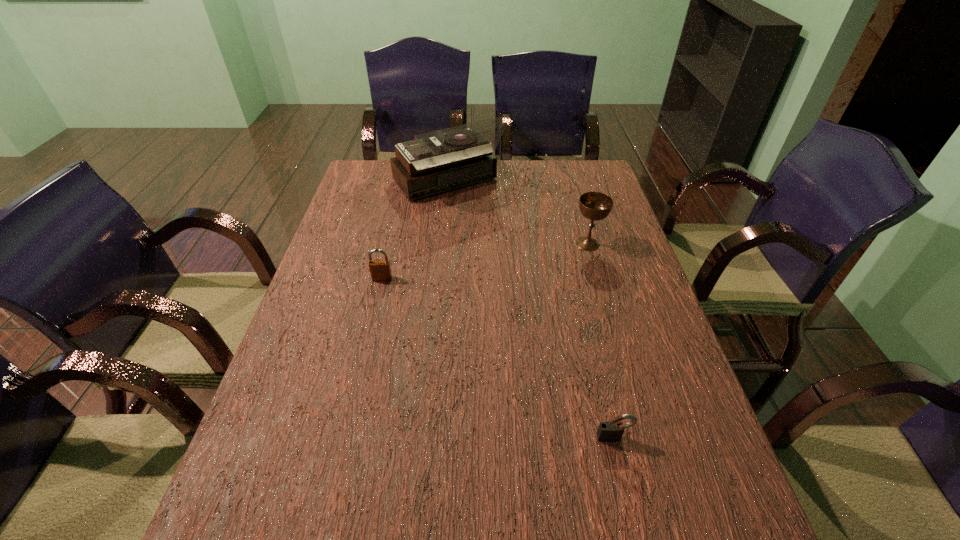
Find the location of a particular element. vacant space at the right edge of the desktop is located at coordinates (661, 404).

Where is `blank space at the far left corner`? The height and width of the screenshot is (540, 960). blank space at the far left corner is located at coordinates (355, 183).

Identify the location of free region at the far right corner of the desktop. (612, 194).

Identify the location of free space between the nearer padlock and the farthest object. The image size is (960, 540). (530, 311).

The width and height of the screenshot is (960, 540). Find the location of `free point between the second tallest object and the record player`. free point between the second tallest object and the record player is located at coordinates point(517,214).

This screenshot has width=960, height=540. I want to click on empty location between the second farthest object and the taller padlock, so click(485, 261).

The height and width of the screenshot is (540, 960). I want to click on free area in between the right padlock and the third nearest object, so click(600, 341).

Identify the location of blank region between the chalice and the second nearest object. (485, 261).

At what (x,y) coordinates should I click in order to perform the action: click on empty location between the farther padlock and the tallest object. Please return your answer as a coordinate pair (x, y). This screenshot has height=540, width=960. Looking at the image, I should click on (415, 232).

Locate an element on the screen. This screenshot has width=960, height=540. vacant point located between the second tallest object and the nearest object is located at coordinates (600, 341).